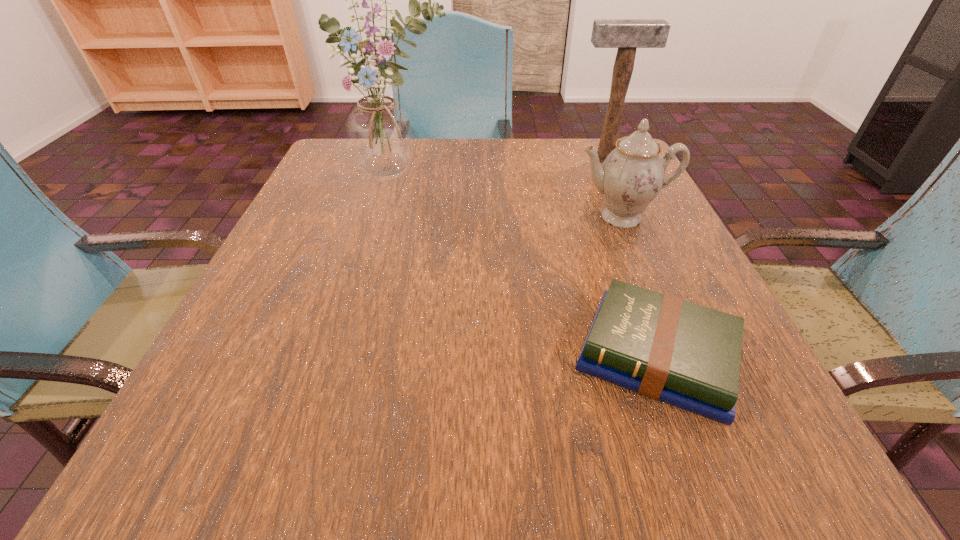
Identify the location of vacant area that lies between the bouquet and the third shortest object. The height and width of the screenshot is (540, 960). (501, 167).

This screenshot has height=540, width=960. What are the coordinates of `free space between the third farthest object and the tallest object` in the screenshot? It's located at (509, 196).

Find the location of a particular element. blank region between the shortest object and the mallet is located at coordinates (631, 258).

This screenshot has width=960, height=540. In order to click on free space between the shortest object and the third farthest object in this screenshot , I will do `click(638, 287)`.

This screenshot has width=960, height=540. In order to click on the third closest object to the shortest object in this screenshot , I will do `click(627, 35)`.

Select which object is the closest to the leftmost object. Please provide its 2D coordinates. Your answer should be formatted as a tuple, i.e. [(x, y)], where the tuple contains the x and y coordinates of a point satisfying the conditions above.

[(632, 175)]

This screenshot has height=540, width=960. In order to click on blank space that satisfies the following two spatial constraints: 1. on the front-facing side of the bouquet; 2. on the left side of the book in this screenshot , I will do `click(348, 356)`.